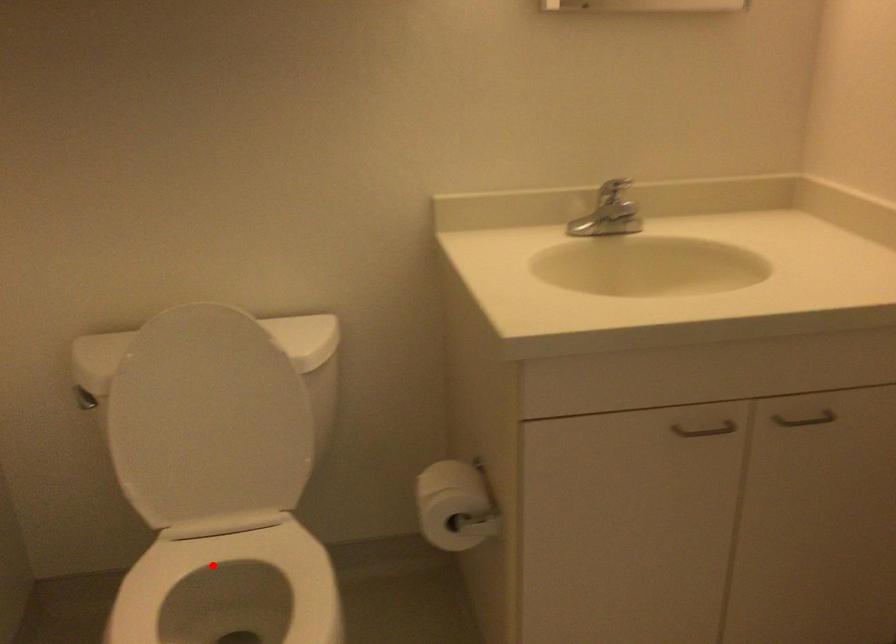
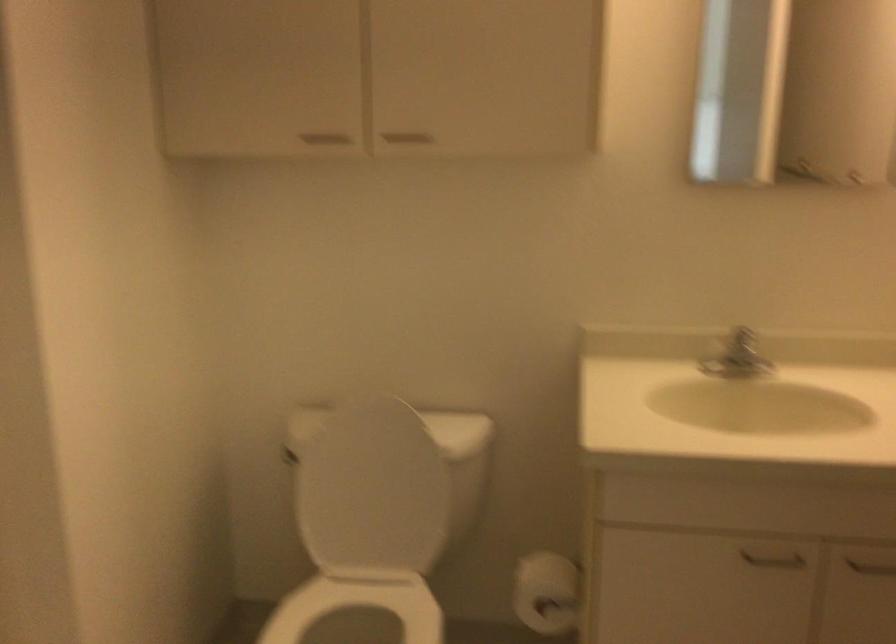
Question: I am providing you with two images of the same scene from different viewpoints. In image1, a red point is highlighted. Considering the same 3D point in image2, which of the following is correct?

Choices:
 (A) It is closer
 (B) It is farther

Answer: (B)